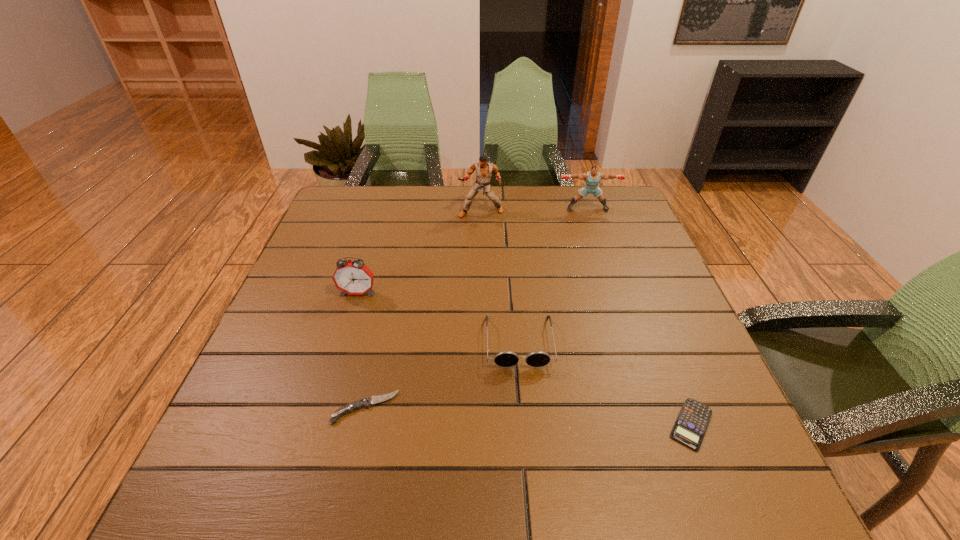
Locate an element on the screen. vacant space located 0.070m on the front-facing side of the tallest object is located at coordinates (481, 233).

This screenshot has height=540, width=960. What are the coordinates of `free space located 0.210m on the front-facing side of the shorter puncher` in the screenshot? It's located at (603, 255).

Where is `free region located on the clock face of the fourth nearest object`? free region located on the clock face of the fourth nearest object is located at coordinates (351, 313).

You are a GUI agent. You are given a task and a screenshot of the screen. Output one action in this format:
    pyautogui.click(x=<x>, y=<y>)
    Task: Click on the free space located 0.250m on the front-facing side of the fourth tallest object
    
    Given the screenshot: What is the action you would take?
    532,494

This screenshot has width=960, height=540. In order to click on vacant area located 0.380m on the right of the fifth tallest object in this screenshot , I will do `click(596, 408)`.

Find the location of `vacant space located 0.270m on the back of the calculator`. vacant space located 0.270m on the back of the calculator is located at coordinates (642, 302).

At what (x,y) coordinates should I click in order to perform the action: click on object that is at the left edge. Please return your answer as a coordinate pair (x, y). Looking at the image, I should click on (353, 277).

You are a GUI agent. You are given a task and a screenshot of the screen. Output one action in this format:
    pyautogui.click(x=<x>, y=<y>)
    Task: Click on the puncher that is at the right edge
    Image resolution: width=960 pixels, height=540 pixels.
    Given the screenshot: What is the action you would take?
    click(x=592, y=178)

Identify the location of calculator positioned at the right edge. This screenshot has width=960, height=540. (690, 427).

Find the location of a particular element. This screenshot has width=960, height=540. object that is at the far right corner is located at coordinates (592, 178).